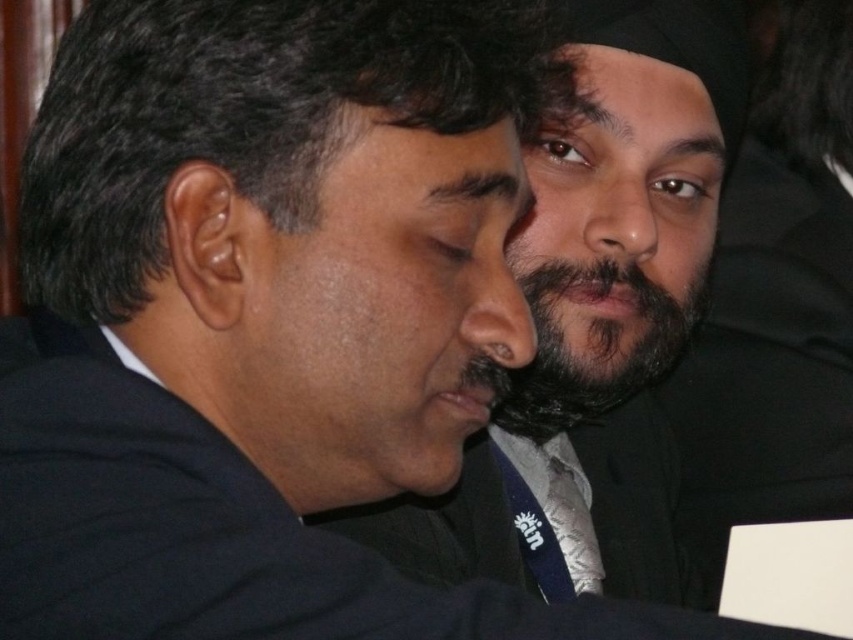
You are standing at the center of the image. Which direction should you move to get closer to the black matte suit at left?

Since the black matte suit at left is located at point 0.830 in the x coordinate and 0.252 in the y coordinate, you should move to the left to get closer to it.

You are standing in a room and see a point at coordinates point (583, 154). If you want to place a 100 centimeter long ruler from this point to the farthest wall, will the ruler fit without bending?

The distance of point (583, 154) from viewer is 93.28 centimeters. Since the ruler is 100 centimeters long, it will extend beyond the point to the wall, so it will fit without bending as the distance is less than the ruler length.

You are a photographer adjusting the focus on your camera. You want to ensure both the black matte suit at center and the silver metallic tie at center are in sharp focus. Given that your camera can only focus on objects within a 5 inch range, will both items be in focus?

The black matte suit at center and the silver metallic tie at center are 6.28 inches apart from each other. Since the distance between them exceeds the camera focus range of 5 inches, both items cannot be in focus simultaneously.